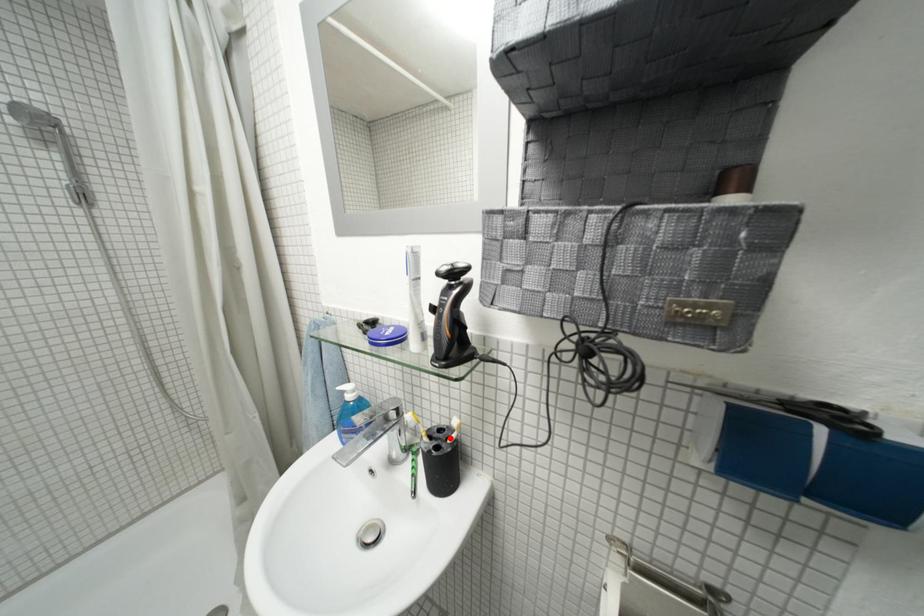
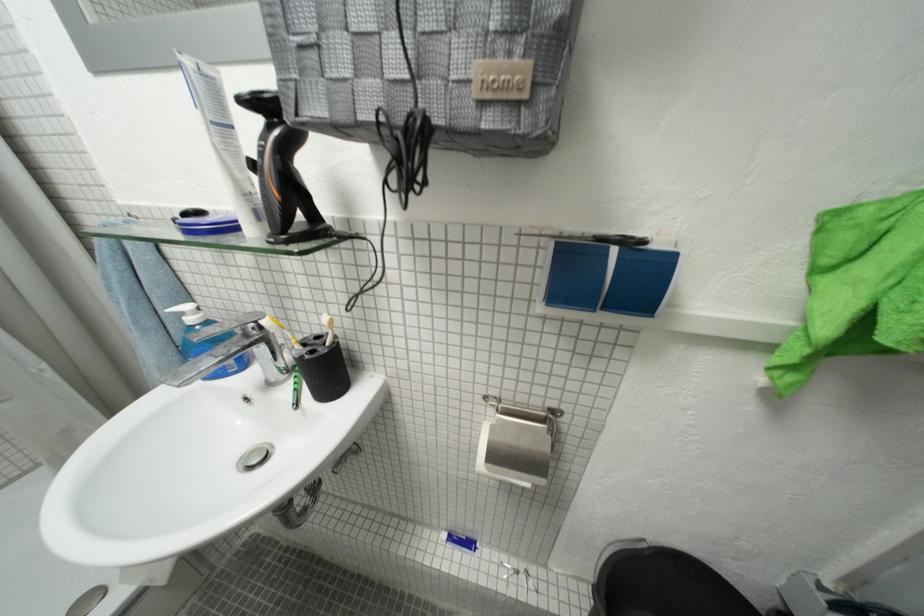
Where in the second image is the point corresponding to the highlighted location from the first image?

(325, 342)